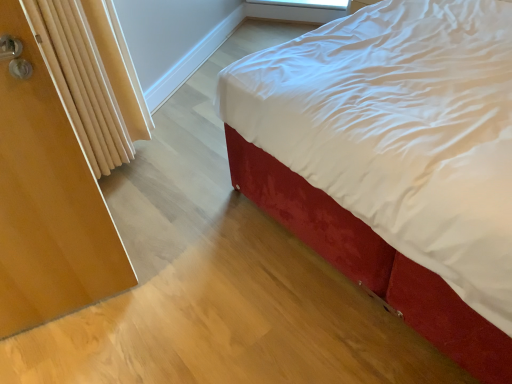
Question: From their relative heights in the image, would you say wooden radiator at left is taller or shorter than wooden screen door at left?

Choices:
 (A) short
 (B) tall

Answer: (A)

Question: Relative to wooden screen door at left, is wooden radiator at left in front or behind?

Choices:
 (A) behind
 (B) front

Answer: (A)

Question: Which of these objects is positioned closest to the velvet red bed at center?

Choices:
 (A) transparent plastic window screen at upper center
 (B) wooden screen door at left
 (C) wooden radiator at left

Answer: (B)

Question: Considering the real-world distances, which object is farthest from the wooden screen door at left?

Choices:
 (A) transparent plastic window screen at upper center
 (B) wooden radiator at left
 (C) velvet red bed at center

Answer: (A)